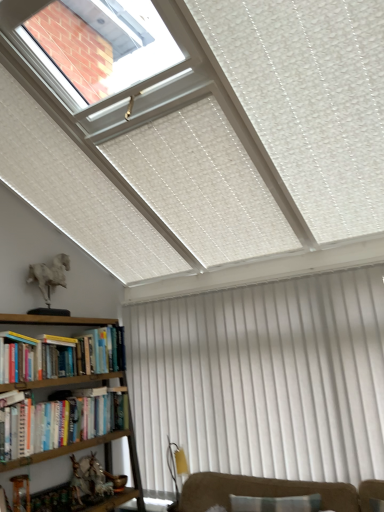
Locate an element on the screen. Image resolution: width=384 pixels, height=512 pixels. hardcover book at lower left, the 3th book positioned from the top is located at coordinates (63, 425).

This screenshot has height=512, width=384. Describe the element at coordinates (105, 459) in the screenshot. I see `wooden bookshelf at lower left` at that location.

Locate an element on the screen. hardcover book at lower left, the 3th book positioned from the top is located at coordinates (63, 425).

Which object is wider, white textured curtain at lower right or wooden bookshelf at lower left?

wooden bookshelf at lower left.

Is white textured curtain at lower right not close to wooden bookshelf at lower left?

They are positioned close to each other.

Based on the photo, measure the distance from white textured curtain at lower right to wooden bookshelf at lower left.

They are 36.89 inches apart.

Is white textured curtain at lower right in front of or behind wooden bookshelf at lower left in the image?

white textured curtain at lower right is behind wooden bookshelf at lower left.

Does hardcover book at left, which ranks as the 1th book in top-to-bottom order, have a larger size compared to wooden bookshelf at lower left?

Actually, hardcover book at left, which ranks as the 1th book in top-to-bottom order, might be smaller than wooden bookshelf at lower left.

Based on the photo, which of these two, hardcover book at left, marked as the third book in a bottom-to-top arrangement, or wooden bookshelf at lower left, is wider?

Wider between the two is wooden bookshelf at lower left.

From the image's perspective, is hardcover book at left, which ranks as the 1th book in top-to-bottom order, positioned above or below wooden bookshelf at lower left?

hardcover book at left, which ranks as the 1th book in top-to-bottom order, is situated higher than wooden bookshelf at lower left in the image.

Is wooden bookshelf at lower left positioned far away from hardcover book at left, positioned as the second book in bottom-to-top order?

No, wooden bookshelf at lower left is not far from hardcover book at left, positioned as the second book in bottom-to-top order.

From a real-world perspective, is wooden bookshelf at lower left under hardcover book at left, the second book in the top-to-bottom sequence?

Yes, from a real-world perspective, wooden bookshelf at lower left is below hardcover book at left, the second book in the top-to-bottom sequence.

Is point (51, 454) closer or farther from the camera than point (97, 366)?

Point (51, 454) is closer to the camera than point (97, 366).

Between point (78, 442) and point (158, 444), which one is positioned behind?

The point (158, 444) is behind.

From the image's perspective, is hardcover book at lower left, the 3th book positioned from the top, beneath white textured curtain at lower right?

Yes.

Does hardcover book at lower left, the 3th book positioned from the top, have a greater width compared to white textured curtain at lower right?

Yes.

Is hardcover book at lower left, positioned as the 1th book in bottom-to-top order, directly adjacent to white textured curtain at lower right?

No, hardcover book at lower left, positioned as the 1th book in bottom-to-top order, is not making contact with white textured curtain at lower right.

Between white plastic skylight at upper left and hardcover book at lower left, the 3th book positioned from the top, which one has smaller size?

Smaller between the two is hardcover book at lower left, the 3th book positioned from the top.

Locate an element on the screen. bay window lying above the hardcover book at lower left, the 3th book positioned from the top (from the image's perspective) is located at coordinates (106, 46).

Is white plastic skylight at upper left to the left of hardcover book at lower left, the 3th book positioned from the top, from the viewer's perspective?

No.

Which is in front, point (143, 31) or point (11, 465)?

Positioned in front is point (143, 31).

Could you tell me if wooden bookshelf at lower left is facing hardcover book at lower left, positioned as the 1th book in bottom-to-top order?

Yes.

Is wooden bookshelf at lower left to the left of hardcover book at lower left, the 3th book positioned from the top, from the viewer's perspective?

Indeed, wooden bookshelf at lower left is positioned on the left side of hardcover book at lower left, the 3th book positioned from the top.

Is wooden bookshelf at lower left taller than hardcover book at lower left, positioned as the 1th book in bottom-to-top order?

Yes.

Considering the positions of points (47, 322) and (70, 429), is point (47, 322) closer to camera compared to point (70, 429)?

That is True.

Between white plastic skylight at upper left and white textured curtain at lower right, which one has less height?

Standing shorter between the two is white plastic skylight at upper left.

Between point (123, 66) and point (205, 313), which one is positioned in front?

The point (123, 66) is closer to the camera.

Looking at their sizes, would you say white plastic skylight at upper left is wider or thinner than white textured curtain at lower right?

In the image, white plastic skylight at upper left appears to be wider than white textured curtain at lower right.

Considering the relative positions of white plastic skylight at upper left and white textured curtain at lower right in the image provided, is white plastic skylight at upper left to the right of white textured curtain at lower right from the viewer's perspective?

No.

I want to click on bookcase below the white textured curtain at lower right (from the image's perspective), so click(x=105, y=459).

Image resolution: width=384 pixels, height=512 pixels. What are the coordinates of `the 2nd book located above the wooden bookshelf at lower left (from a real-world perspective)` in the screenshot? It's located at (18, 357).

Estimate the real-world distances between objects in this image. Which object is further from hardcover book at lower left, the 3th book positioned from the top, wooden bookshelf at lower left or white textured curtain at lower right?

white textured curtain at lower right.

Based on their spatial positions, is wooden bookshelf at lower left or white textured curtain at lower right further from hardcover book at left, which ranks as the 1th book in top-to-bottom order?

The object further to hardcover book at left, which ranks as the 1th book in top-to-bottom order, is white textured curtain at lower right.

Based on the photo, considering their positions, is white textured curtain at lower right positioned further to hardcover book at left, the second book in the top-to-bottom sequence, than hardcover book at lower left, the 3th book positioned from the top?

white textured curtain at lower right lies further to hardcover book at left, the second book in the top-to-bottom sequence, than the other object.

Based on their spatial positions, is wooden bookshelf at lower left or hardcover book at left, which ranks as the 1th book in top-to-bottom order, closer to hardcover book at left, the second book in the top-to-bottom sequence?

hardcover book at left, which ranks as the 1th book in top-to-bottom order.

Considering their positions, is hardcover book at lower left, the 3th book positioned from the top, positioned closer to hardcover book at left, which ranks as the 1th book in top-to-bottom order, than wooden bookshelf at lower left?

hardcover book at lower left, the 3th book positioned from the top.

Based on their spatial positions, is wooden bookshelf at lower left or hardcover book at left, which ranks as the 1th book in top-to-bottom order, further from white plastic skylight at upper left?

wooden bookshelf at lower left lies further to white plastic skylight at upper left than the other object.

Looking at the image, which one is located further to hardcover book at left, the second book in the top-to-bottom sequence, hardcover book at left, which ranks as the 1th book in top-to-bottom order, or hardcover book at lower left, positioned as the 1th book in bottom-to-top order?

Based on the image, hardcover book at left, which ranks as the 1th book in top-to-bottom order, appears to be further to hardcover book at left, the second book in the top-to-bottom sequence.

Considering their positions, is hardcover book at left, marked as the third book in a bottom-to-top arrangement, positioned further to hardcover book at lower left, the 3th book positioned from the top, than white plastic skylight at upper left?

Based on the image, white plastic skylight at upper left appears to be further to hardcover book at lower left, the 3th book positioned from the top.

Identify the location of curtain that lies between white plastic skylight at upper left and hardcover book at lower left, positioned as the 1th book in bottom-to-top order, from top to bottom. The image size is (384, 512). (263, 379).

Find the location of `book located between hardcover book at left, marked as the third book in a bottom-to-top arrangement, and hardcover book at left, the second book in the top-to-bottom sequence, in the depth direction`. book located between hardcover book at left, marked as the third book in a bottom-to-top arrangement, and hardcover book at left, the second book in the top-to-bottom sequence, in the depth direction is located at coordinates (63, 425).

Locate an element on the screen. Image resolution: width=384 pixels, height=512 pixels. book situated between hardcover book at lower left, the 3th book positioned from the top, and white textured curtain at lower right from left to right is located at coordinates (106, 349).

Where is `book between white plastic skylight at upper left and hardcover book at left, the second book in the top-to-bottom sequence, in the up-down direction`? book between white plastic skylight at upper left and hardcover book at left, the second book in the top-to-bottom sequence, in the up-down direction is located at coordinates (18, 357).